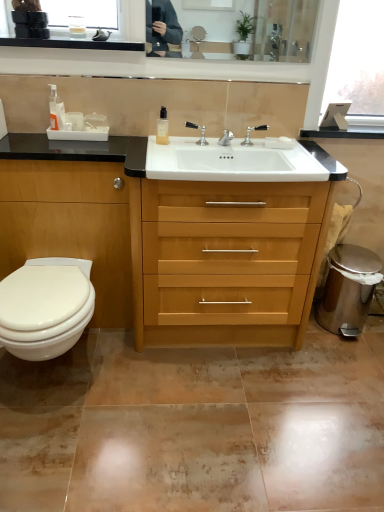
You are a GUI agent. You are given a task and a screenshot of the screen. Output one action in this format:
    pyautogui.click(x=<x>, y=<y>)
    Task: Click on the unoccupied region to the right of polished silver faucet at center
    The image size is (384, 512).
    Given the screenshot: What is the action you would take?
    pyautogui.click(x=230, y=147)